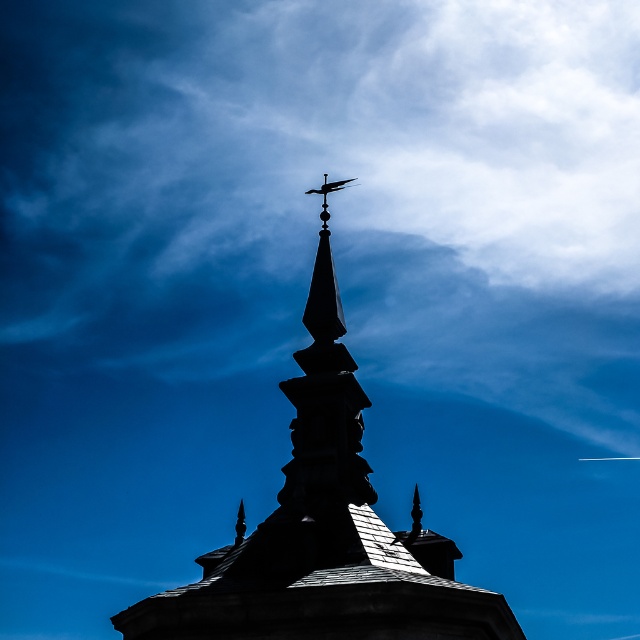
Is point (140, 140) in front of point (412, 534)?

No, it is not.

Image resolution: width=640 pixels, height=640 pixels. Describe the element at coordinates (330, 195) in the screenshot. I see `blue sky at upper center` at that location.

Identify the location of blue sky at upper center. (330, 195).

Which of these two, silhouette stone tower at center or black matte weather vane at upper center, stands shorter?

With less height is black matte weather vane at upper center.

Is silhouette stone tower at center to the right of black matte weather vane at upper center from the viewer's perspective?

In fact, silhouette stone tower at center is to the left of black matte weather vane at upper center.

Is point (500, 614) in front of point (324, 204)?

Yes, it is in front of point (324, 204).

I want to click on silhouette stone tower at center, so click(324, 532).

Which is behind, point (627, 332) or point (326, 186)?

Point (627, 332)

Is blue sky at upper center thinner than black matte weather vane at upper center?

No, blue sky at upper center is not thinner than black matte weather vane at upper center.

Is point (355, 291) farther from camera compared to point (317, 189)?

Yes, point (355, 291) is behind point (317, 189).

You are a GUI agent. You are given a task and a screenshot of the screen. Output one action in this format:
    pyautogui.click(x=<x>, y=<y>)
    Task: Click on the blue sky at upper center
    Image resolution: width=640 pixels, height=640 pixels.
    Given the screenshot: What is the action you would take?
    pyautogui.click(x=330, y=195)